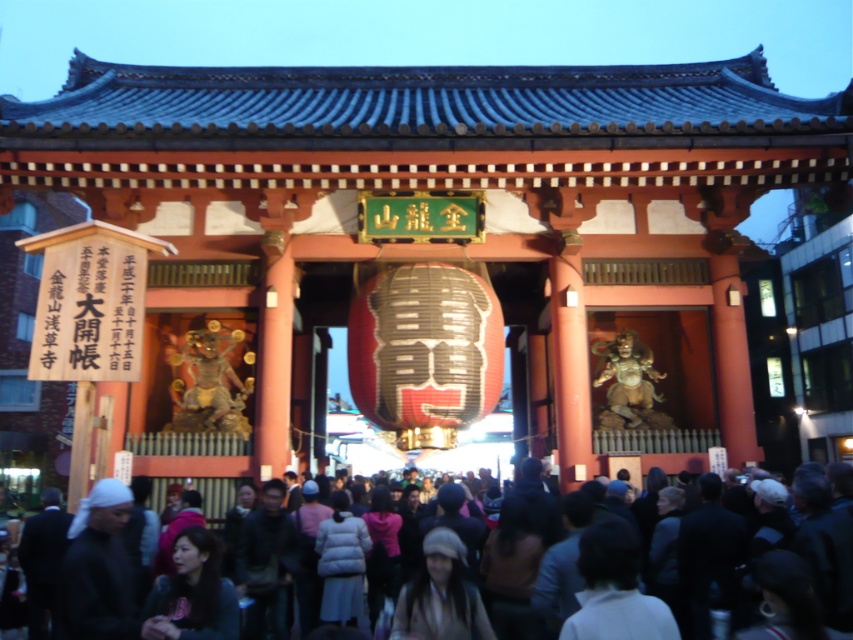
Consider the image. You are a photographer at the temple gate and want to capture both the matte black hair at lower center and the light brown hair at center in a single frame. Given their widths, which hairstyle should you focus on to ensure both fit in the photo without cropping?

Since the matte black hair at lower center is narrower than the light brown hair at center, you should focus on framing the wider light brown hair at center to accommodate both in the photo.

You are a photographer standing at the entrance of the temple gate. You want to take a photo of the dark clothing crowd at lower center and the matte black hair at lower center. Which object should you focus on first to ensure both are in frame without moving the camera?

The dark clothing crowd at lower center has a greater height compared to the matte black hair at lower center, so you should focus on the dark clothing crowd at lower center first to ensure both are in frame without moving the camera.